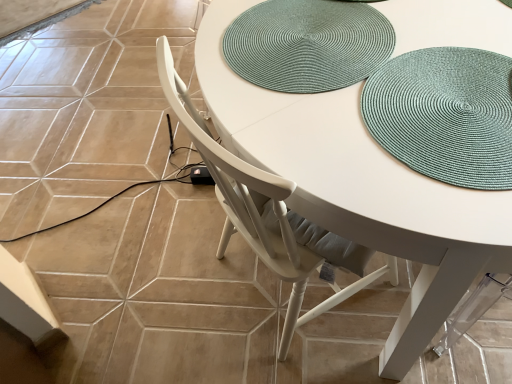
Question: Is teal woven placemat at upper right positioned with its back to white wood chair at center?

Choices:
 (A) yes
 (B) no

Answer: (A)

Question: Could you tell me if teal woven placemat at upper right is turned towards white wood chair at center?

Choices:
 (A) no
 (B) yes

Answer: (B)

Question: Is teal woven placemat at upper right thinner than white wood chair at center?

Choices:
 (A) yes
 (B) no

Answer: (A)

Question: Is teal woven placemat at upper right bigger than white wood chair at center?

Choices:
 (A) no
 (B) yes

Answer: (A)

Question: Considering the relative sizes of teal woven placemat at upper right and white wood chair at center in the image provided, is teal woven placemat at upper right shorter than white wood chair at center?

Choices:
 (A) yes
 (B) no

Answer: (A)

Question: From a real-world perspective, is teal woven placemat at upper right positioned under white wood chair at center based on gravity?

Choices:
 (A) yes
 (B) no

Answer: (B)

Question: Is the position of teal woven placemat at upper right less distant than that of teal woven placemat at upper center?

Choices:
 (A) yes
 (B) no

Answer: (A)

Question: Does teal woven placemat at upper right have a lesser width compared to teal woven placemat at upper center?

Choices:
 (A) yes
 (B) no

Answer: (B)

Question: From the image's perspective, is teal woven placemat at upper right below teal woven placemat at upper center?

Choices:
 (A) no
 (B) yes

Answer: (B)

Question: Can teal woven placemat at upper center be found inside teal woven placemat at upper right?

Choices:
 (A) no
 (B) yes

Answer: (A)

Question: Is teal woven placemat at upper right taller than teal woven placemat at upper center?

Choices:
 (A) no
 (B) yes

Answer: (B)

Question: Is teal woven placemat at upper right aimed at teal woven placemat at upper center?

Choices:
 (A) yes
 (B) no

Answer: (B)

Question: Is white wood chair at center looking in the opposite direction of teal woven placemat at upper center?

Choices:
 (A) yes
 (B) no

Answer: (B)